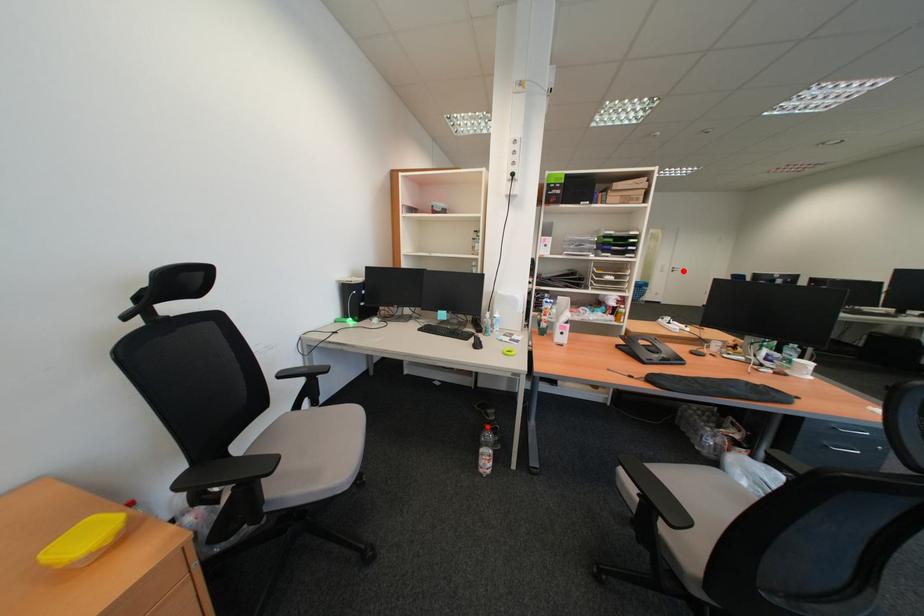
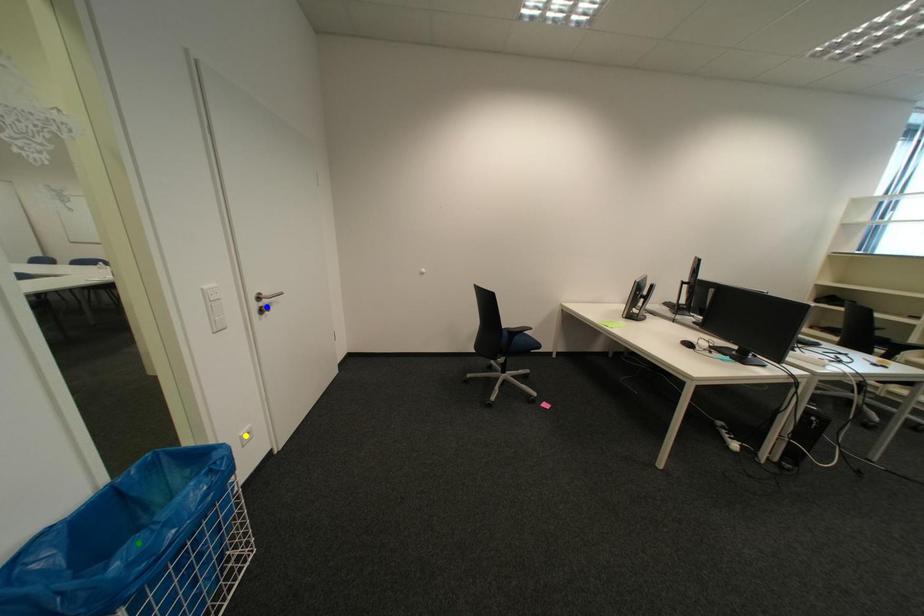
Question: I am providing you with two images of the same scene from different viewpoints. A red point is marked on the first image. You are given multiple points on the second image. Which point in image 2 is actually the same real-world point as the red point in image 1?

Choices:
 (A) yellow point
 (B) green point
 (C) blue point

Answer: (C)